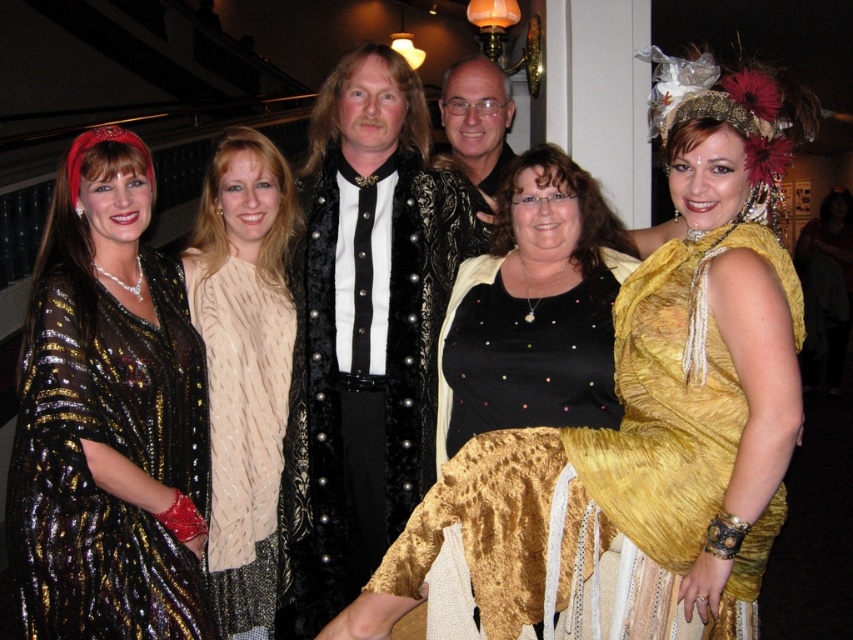
Is shiny sequined dress at left closer to camera compared to beige knitted sweater at center?

Yes, it is.

Between point (169, 620) and point (199, 221), which one is positioned in front?

Point (169, 620) is more forward.

Between point (177, 506) and point (216, 221), which one is positioned in front?

Point (177, 506) is in front.

Identify the location of shiny sequined dress at left. The width and height of the screenshot is (853, 640). (108, 417).

Between point (767, 397) and point (521, 205), which one is positioned in front?

Point (767, 397)

Does point (564, 531) come closer to viewer compared to point (554, 148)?

Yes, point (564, 531) is closer to viewer.

The image size is (853, 640). What are the coordinates of `gold sequined dress at center` in the screenshot? It's located at (643, 416).

Find the location of a particular element. gold sequined dress at center is located at coordinates (x=643, y=416).

Is gold sequined dress at center taller than shiny sequined dress at left?

No.

Who is lower down, gold sequined dress at center or shiny sequined dress at left?

Positioned lower is gold sequined dress at center.

Between point (792, 444) and point (184, 397), which one is positioned behind?

Positioned behind is point (184, 397).

Identify the location of gold sequined dress at center. This screenshot has width=853, height=640. (643, 416).